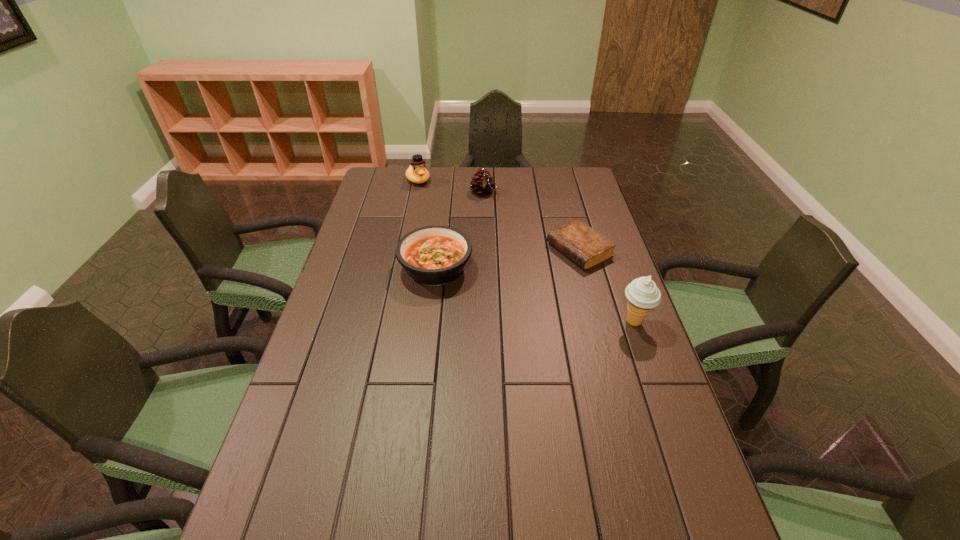
Image resolution: width=960 pixels, height=540 pixels. What are the coordinates of `vacant region located 0.070m with a leaf charm attached to the pinecone` in the screenshot? It's located at (492, 210).

At what (x,y) coordinates should I click in order to perform the action: click on vacant space located 0.050m on the spine side of the diary. Please return your answer as a coordinate pair (x, y). Image resolution: width=960 pixels, height=540 pixels. Looking at the image, I should click on (543, 268).

This screenshot has height=540, width=960. I want to click on vacant space located on the spine side of the diary, so 499,289.

The height and width of the screenshot is (540, 960). Identify the location of vacant space situated 0.270m on the spine side of the diary. (489, 294).

Where is `vacant area situated on the front-facing side of the duck`? vacant area situated on the front-facing side of the duck is located at coordinates (457, 231).

Image resolution: width=960 pixels, height=540 pixels. Find the location of `free space located on the front-facing side of the duck`. free space located on the front-facing side of the duck is located at coordinates (456, 230).

The image size is (960, 540). I want to click on blank area located 0.080m on the front-facing side of the duck, so click(x=430, y=197).

Find the location of `pinecone at the far edge`. pinecone at the far edge is located at coordinates (483, 184).

Where is `duck located at the far edge`? duck located at the far edge is located at coordinates (416, 173).

Locate an element on the screen. object at the left edge is located at coordinates (416, 173).